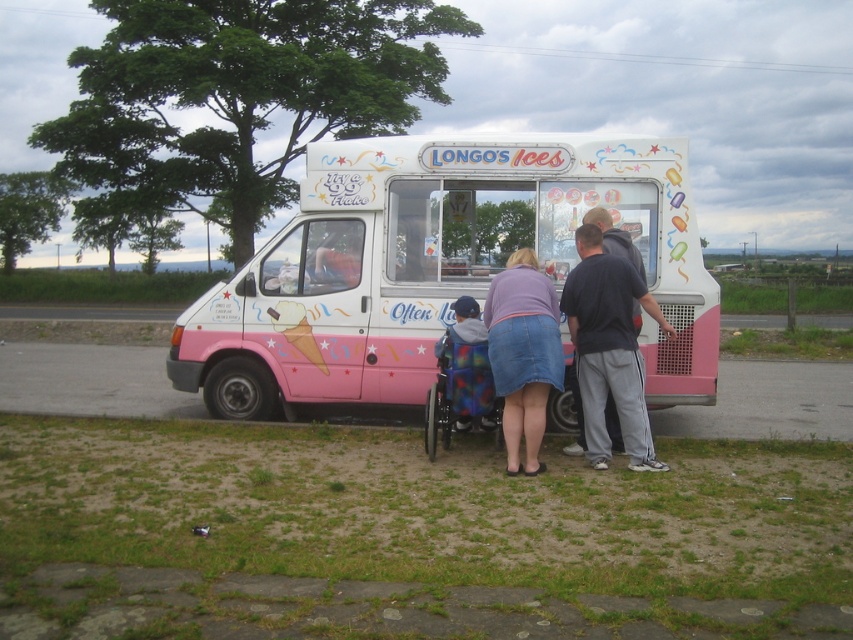
You are a customer waiting in line to buy ice cream. You notice the pink matte ice cream truck at center and the purple denim skirt at lower center. Which object is closer to you?

The purple denim skirt at lower center is closer to you because the pink matte ice cream truck at center is positioned over it, indicating it is further away.

Looking at this image, you are planning to bring a 1.2 meter wide delivery cart through the space between the rainbow fabric wheelchair at center and the dark gray sweatpants at center. Based on the scene description, can the cart fit through the space between them?

The rainbow fabric wheelchair at center is wider than the dark gray sweatpants at center. However, without specific measurements of the space between them, it is impossible to determine if the 1.2 meter wide delivery cart can fit through the space between them.

You are a customer waiting in line to buy ice cream. You notice the pink matte ice cream truck at center and the purple denim skirt at lower center. Which object is smaller in size?

The pink matte ice cream truck at center is smaller in size compared to the purple denim skirt at lower center according to the description.